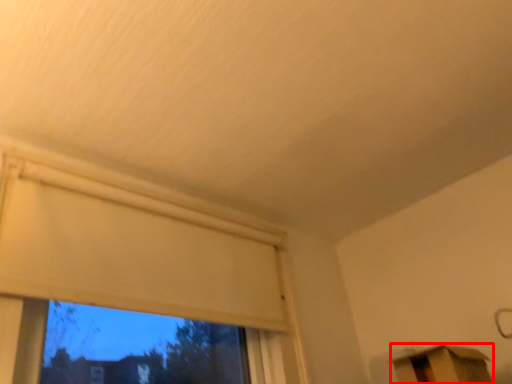
Question: From the image's perspective, considering the relative positions of furniture (annotated by the red box) and window in the image provided, where is furniture (annotated by the red box) located with respect to the staircase?

Choices:
 (A) below
 (B) above

Answer: (A)